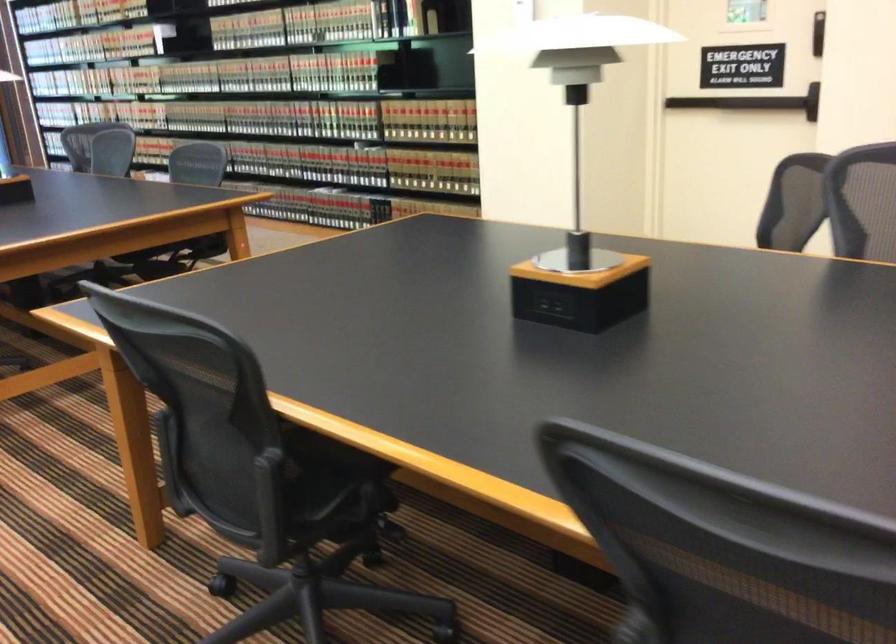
Describe the element at coordinates (546, 303) in the screenshot. I see `the black power outlet` at that location.